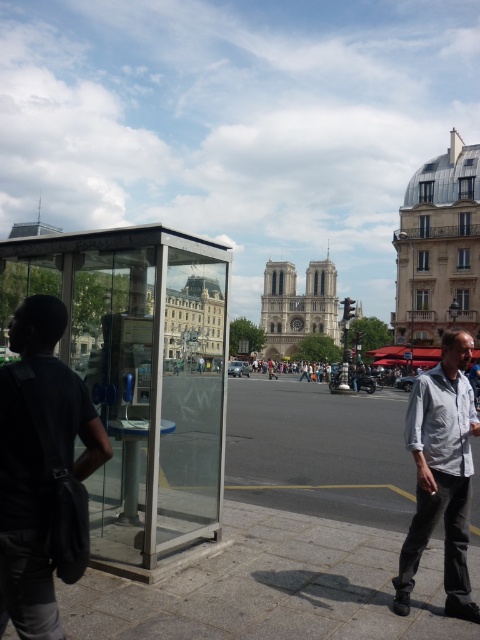
Describe the element at coordinates (271, 588) in the screenshot. I see `gray concrete pavement at lower center` at that location.

Can you confirm if gray concrete pavement at lower center is positioned above dark gray shirt at left?

No.

This screenshot has height=640, width=480. What do you see at coordinates (271, 588) in the screenshot?
I see `gray concrete pavement at lower center` at bounding box center [271, 588].

This screenshot has width=480, height=640. Find the location of `gray concrete pavement at lower center`. gray concrete pavement at lower center is located at coordinates (271, 588).

Is transparent glass bus stop at left smaller than light gray shirt at center?

Yes.

Who is more forward, (182, 516) or (407, 568)?

Positioned in front is point (407, 568).

Is point (189, 492) positioned after point (444, 586)?

Yes, point (189, 492) is farther from viewer.

At what (x,y) coordinates should I click in order to perform the action: click on transparent glass bus stop at left. Please return your answer as a coordinate pair (x, y). Looking at the image, I should click on (141, 378).

Who is taller, transparent glass booth at left or light gray shirt at center?

With more height is transparent glass booth at left.

Can you confirm if transparent glass booth at left is bigger than light gray shirt at center?

No.

What do you see at coordinates (186, 401) in the screenshot? I see `transparent glass booth at left` at bounding box center [186, 401].

You are a GUI agent. You are given a task and a screenshot of the screen. Output one action in this format:
    pyautogui.click(x=<x>, y=<y>)
    Task: Click on the transparent glass booth at left
    The width and height of the screenshot is (480, 640).
    Given the screenshot: What is the action you would take?
    pyautogui.click(x=186, y=401)